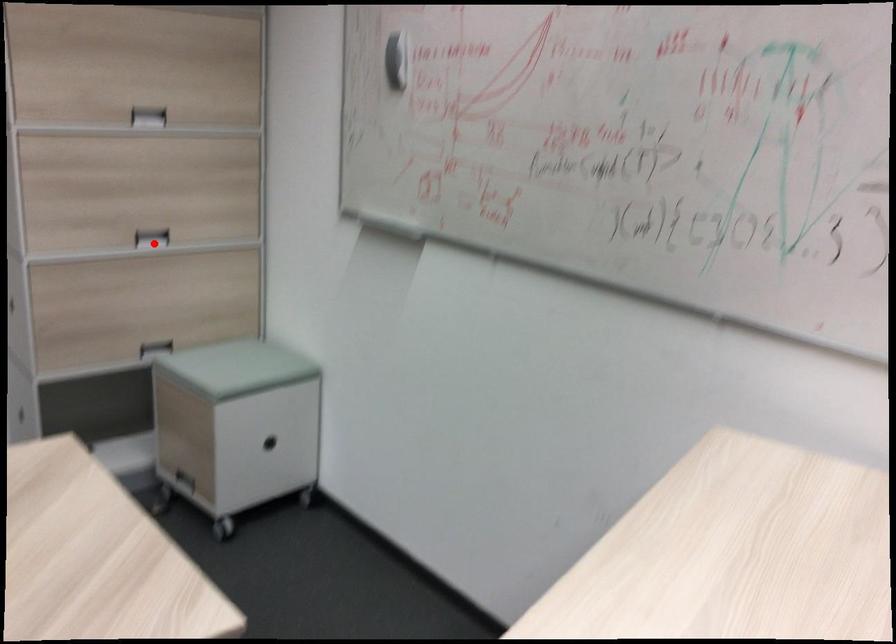
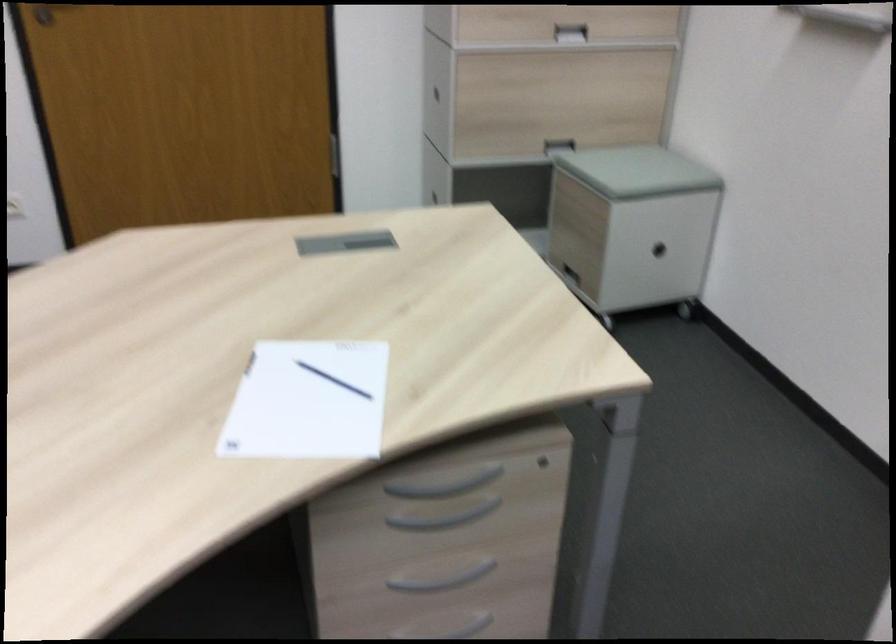
The point at the highlighted location is marked in the first image. Where is the corresponding point in the second image?

(570, 33)